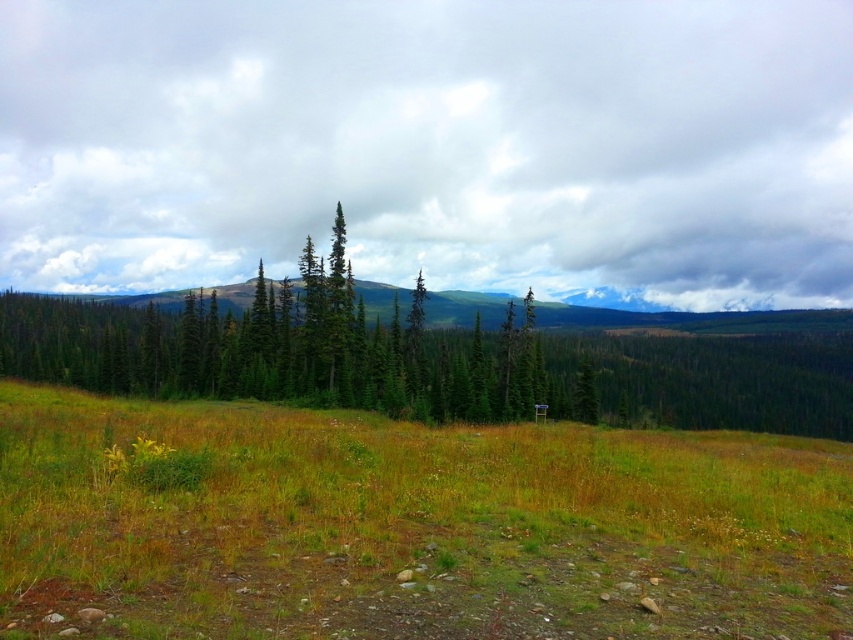
You are standing at the point labeled as point (410, 525) in the image. Based on the scene description, what type of terrain are you currently standing on?

The point (410, 525) corresponds to the green grassy field at lower center, so you are standing on a grassy field with patches of yellowish brown grass, which has an uneven ground scattered with small rocks.

From the picture: You are standing on the green grassy field at lower center and want to walk towards the green matte tree at center. Which direction should you move to reach it?

You should move to the left because the green grassy field at lower center is positioned on the right side of the green matte tree at center, meaning the tree is to your left.